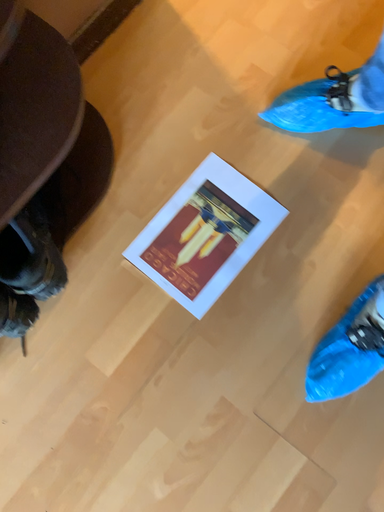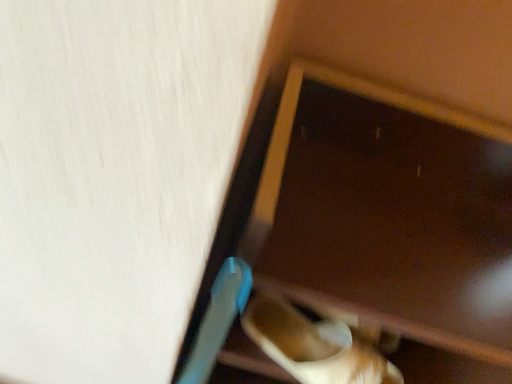
Question: Which way did the camera rotate in the video?

Choices:
 (A) rotated downward
 (B) rotated upward

Answer: (B)